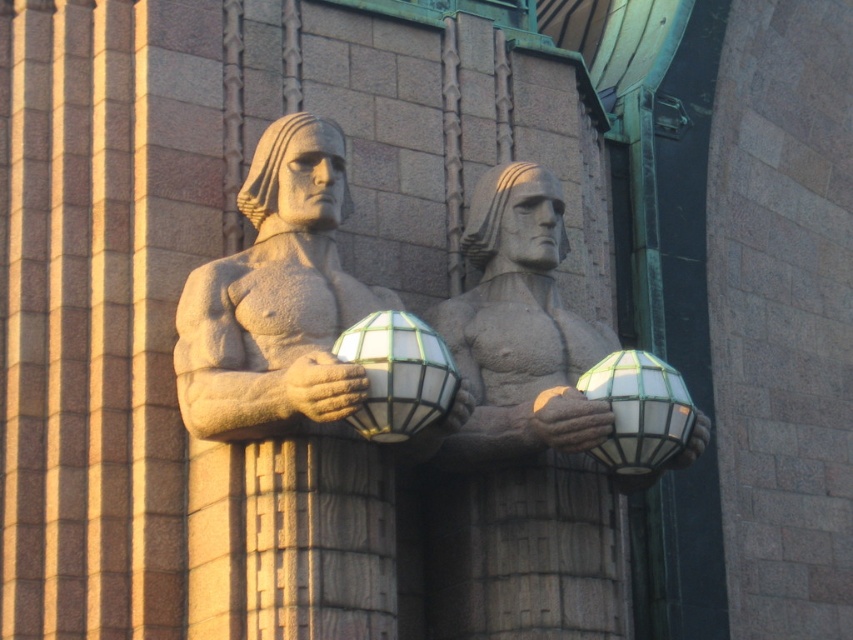
Which is above, sandy stone statue at center or translucent glass sphere at center?

sandy stone statue at center is higher up.

Does sandy stone statue at center have a lesser height compared to translucent glass sphere at center?

In fact, sandy stone statue at center may be taller than translucent glass sphere at center.

Describe the element at coordinates (276, 301) in the screenshot. This screenshot has height=640, width=853. I see `sandy stone statue at center` at that location.

I want to click on sandy stone statue at center, so pos(276,301).

Between point (195, 317) and point (560, 390), which one is positioned in front?

Positioned in front is point (560, 390).

The image size is (853, 640). What do you see at coordinates (276, 301) in the screenshot?
I see `sandy stone statue at center` at bounding box center [276, 301].

What are the coordinates of `sandy stone statue at center` in the screenshot? It's located at (276, 301).

Who is higher up, sandy stone statue at center or smooth stone hand at center?

sandy stone statue at center is higher up.

Who is shorter, sandy stone statue at center or smooth stone hand at center?

smooth stone hand at center is shorter.

Is point (329, 381) positioned after point (299, 408)?

That is False.

Identify the location of sandy stone statue at center. (276, 301).